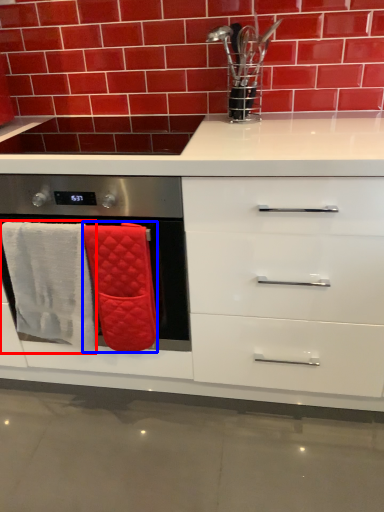
Question: Which point is further to the camera, bath towel (highlighted by a red box) or bath towel (highlighted by a blue box)?

Choices:
 (A) bath towel
 (B) bath towel

Answer: (A)